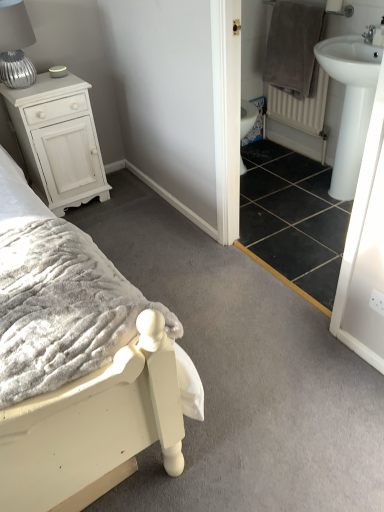
What are the coordinates of `vacant space that is in between white glossy sink at right and white textured radiator at right` in the screenshot? It's located at (300, 200).